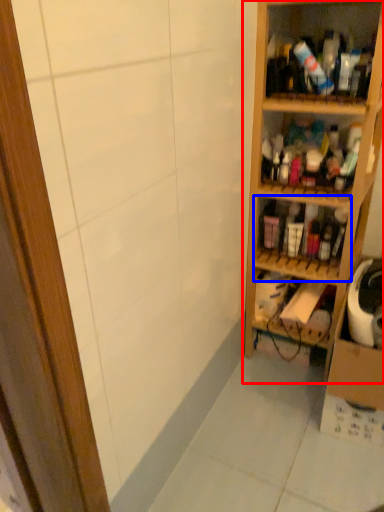
Question: Among these objects, which one is nearest to the camera, shelf (highlighted by a red box) or shelf (highlighted by a blue box)?

Choices:
 (A) shelf
 (B) shelf

Answer: (A)